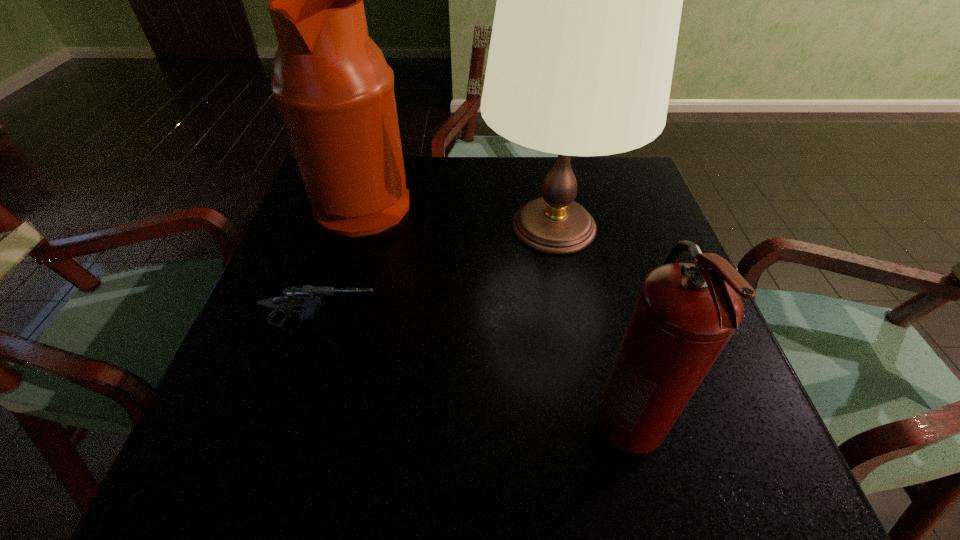
Where is `lamp`? This screenshot has height=540, width=960. lamp is located at coordinates (589, 0).

Where is `water jug`? This screenshot has width=960, height=540. water jug is located at coordinates (335, 91).

Locate an element on the screen. The width and height of the screenshot is (960, 540). the nearest object is located at coordinates (685, 314).

This screenshot has height=540, width=960. I want to click on the second shortest object, so click(685, 314).

The height and width of the screenshot is (540, 960). I want to click on gun, so click(x=309, y=298).

At what (x,y) coordinates should I click in order to perform the action: click on the third farthest object. Please return your answer as a coordinate pair (x, y). Image resolution: width=960 pixels, height=540 pixels. Looking at the image, I should click on (309, 298).

Image resolution: width=960 pixels, height=540 pixels. Find the location of `vacant space located on the front of the lamp`. vacant space located on the front of the lamp is located at coordinates (568, 310).

This screenshot has height=540, width=960. Identify the location of vacant space located 0.220m from the spout of the water jug. (501, 201).

Where is `vacant region located at the barrel of the third farthest object`? This screenshot has width=960, height=540. vacant region located at the barrel of the third farthest object is located at coordinates (570, 326).

Identify the location of lamp that is at the far edge. (589, 0).